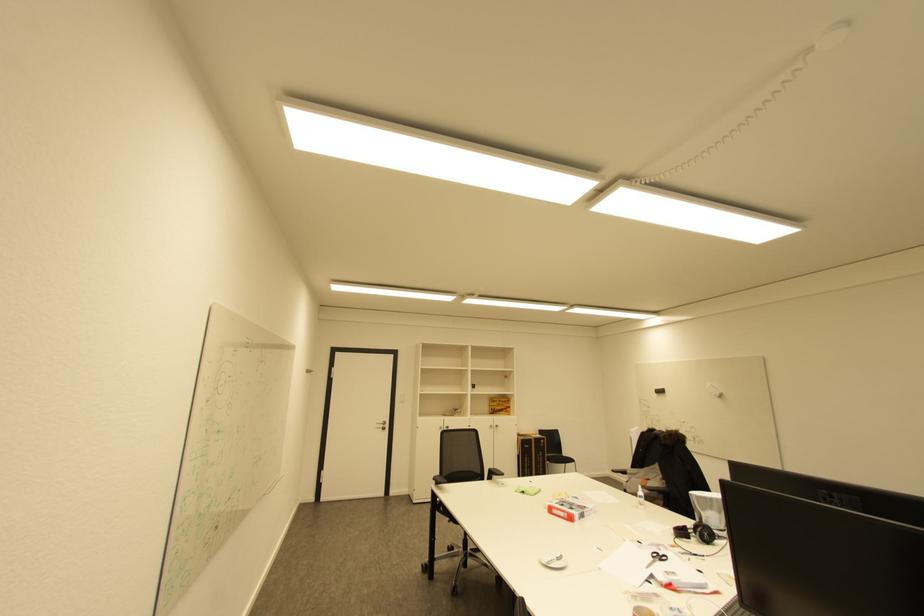
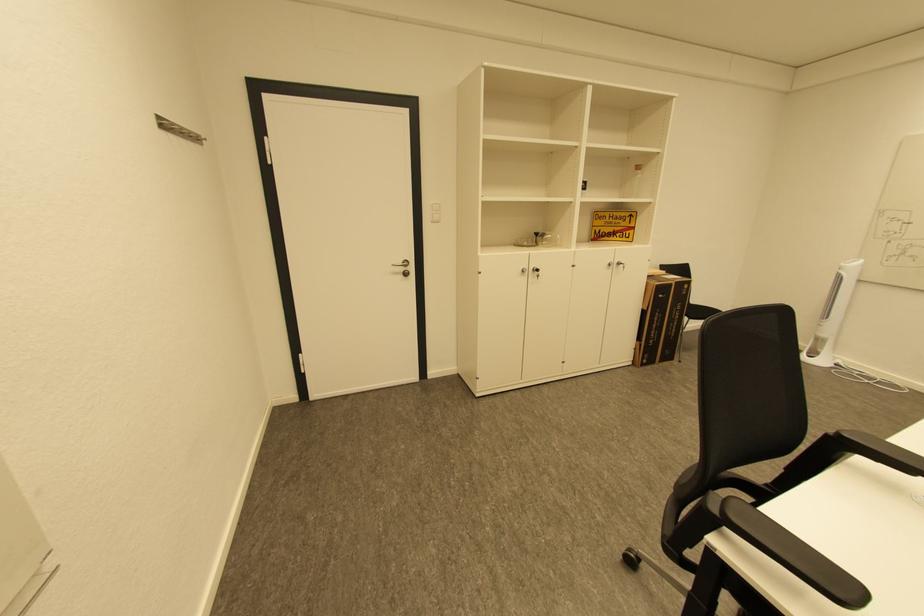
Find the pixel in the second image that matches [499,410] in the first image.

(603, 233)